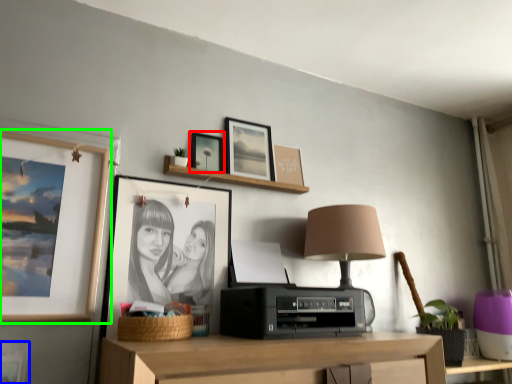
Question: Which object is the closest to the picture frame (highlighted by a red box)? Choose among these: picture frame (highlighted by a blue box) or picture frame (highlighted by a green box).

Choices:
 (A) picture frame
 (B) picture frame

Answer: (B)